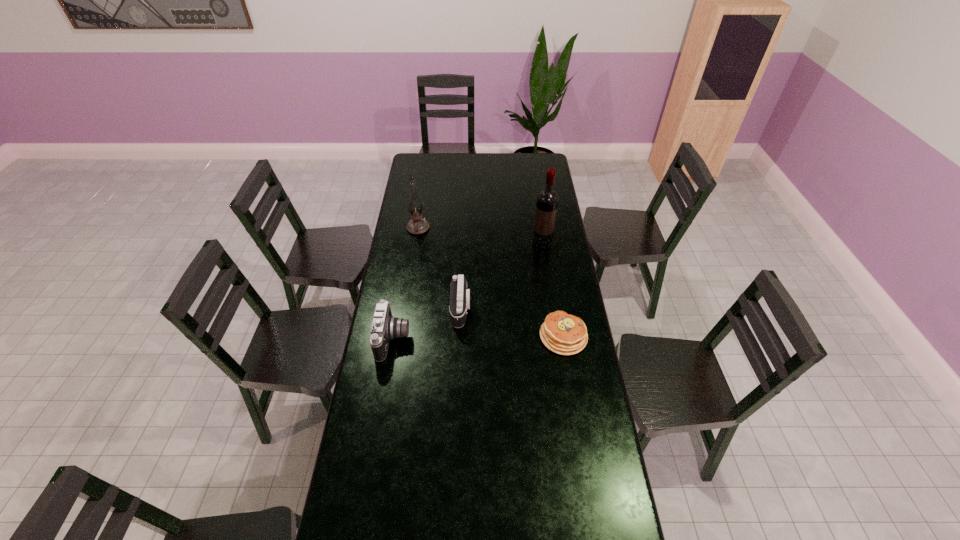
Find the location of a particular element. vacant area between the oil lamp and the left camera is located at coordinates (406, 284).

The height and width of the screenshot is (540, 960). Find the location of `blank region between the wine bottle and the farthest object`. blank region between the wine bottle and the farthest object is located at coordinates (480, 236).

Image resolution: width=960 pixels, height=540 pixels. I want to click on unoccupied area between the right camera and the second farthest object, so click(502, 276).

Find the location of `free space between the right camera and the left camera`. free space between the right camera and the left camera is located at coordinates (427, 324).

Find the location of a particular element. free space between the left camera and the fourth shortest object is located at coordinates (406, 284).

Find the location of `free space that is in between the left camera and the third object from left to right`. free space that is in between the left camera and the third object from left to right is located at coordinates (427, 324).

Where is `vacant space in between the right camera and the pancake`? Image resolution: width=960 pixels, height=540 pixels. vacant space in between the right camera and the pancake is located at coordinates (513, 323).

You are a GUI agent. You are given a task and a screenshot of the screen. Output one action in this format:
    pyautogui.click(x=<x>, y=<y>)
    Task: Click on the vacant space that's between the shortest object and the second farthest object
    
    Given the screenshot: What is the action you would take?
    pyautogui.click(x=553, y=290)

Where is `vacant space in between the fourth nearest object and the shortest object`? vacant space in between the fourth nearest object and the shortest object is located at coordinates (553, 290).

What are the coordinates of `vacant area between the right camera and the pancake` in the screenshot? It's located at (513, 323).